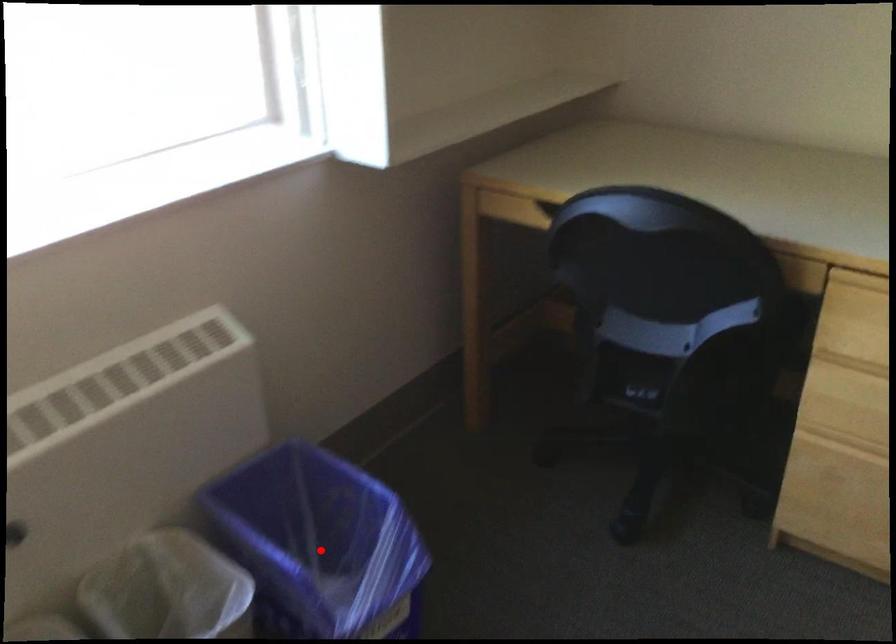
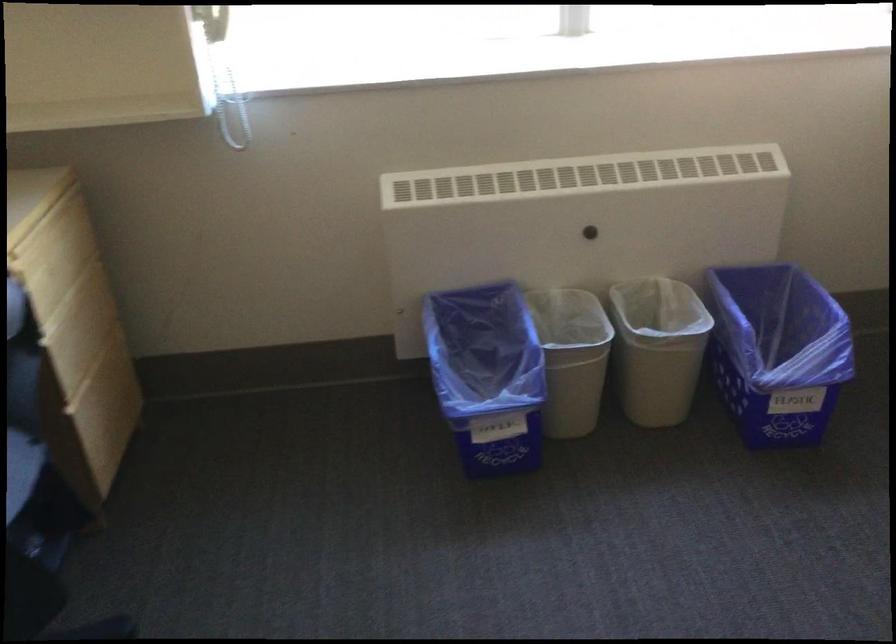
Where in the second image is the point corresponding to the highlighted location from the first image?

(777, 352)